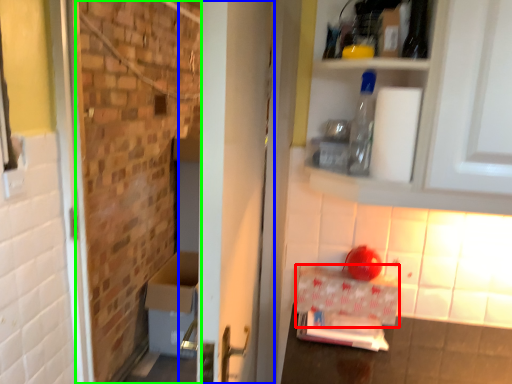
Question: Which is nearer to the cardboard box (highlighted by a red box)? door (highlighted by a blue box) or brickwork (highlighted by a green box).

Choices:
 (A) door
 (B) brickwork

Answer: (A)